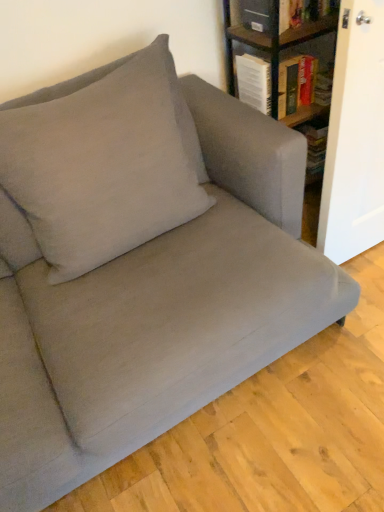
Question: In terms of width, does hardcover book at upper right look wider or thinner when compared to suede-like beige pillow at upper left?

Choices:
 (A) thin
 (B) wide

Answer: (A)

Question: From their relative heights in the image, would you say hardcover book at upper right is taller or shorter than suede-like beige pillow at upper left?

Choices:
 (A) short
 (B) tall

Answer: (A)

Question: Which object is positioned closest to the suede-like beige pillow at upper left?

Choices:
 (A) wooden bookshelf at upper right
 (B) hardcover book at upper right

Answer: (B)

Question: Based on their relative distances, which object is nearer to the suede-like beige pillow at upper left?

Choices:
 (A) hardcover book at upper right
 (B) wooden bookshelf at upper right

Answer: (A)